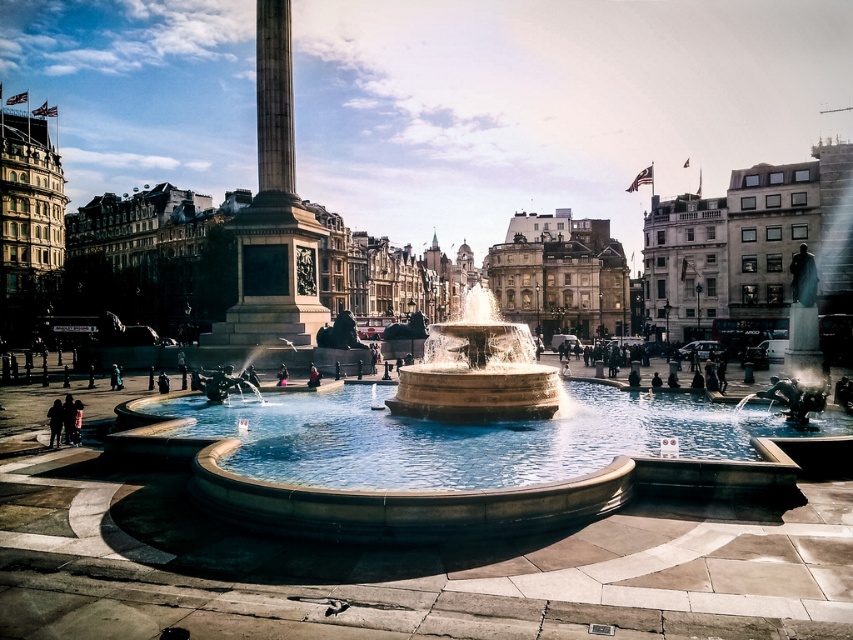
Question: Which point appears farthest from the camera in this image?

Choices:
 (A) (48, 410)
 (B) (282, 372)
 (C) (236, 221)
 (D) (454, 483)

Answer: (C)

Question: Which of the following is the farthest from the observer?

Choices:
 (A) smooth stone fountain at center
 (B) smooth stone obelisk at center
 (C) stone fountain at center

Answer: (B)

Question: Observing the image, what is the correct spatial positioning of smooth stone fountain at center in reference to dark fabric coat at center?

Choices:
 (A) below
 (B) above

Answer: (B)

Question: Does silhouette figure at lower left appear over dark fabric coat at center?

Choices:
 (A) yes
 (B) no

Answer: (B)

Question: Which of the following is the farthest from the observer?

Choices:
 (A) (57, 406)
 (B) (314, 381)

Answer: (B)

Question: Is the position of smooth stone obelisk at center more distant than that of stone fountain at center?

Choices:
 (A) yes
 (B) no

Answer: (A)